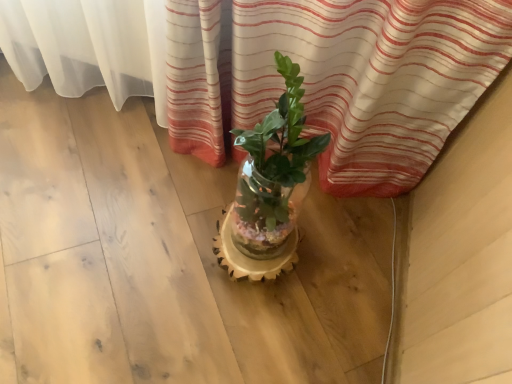
What are the coordinates of `free space in front of translucent glass vase at center` in the screenshot? It's located at (232, 332).